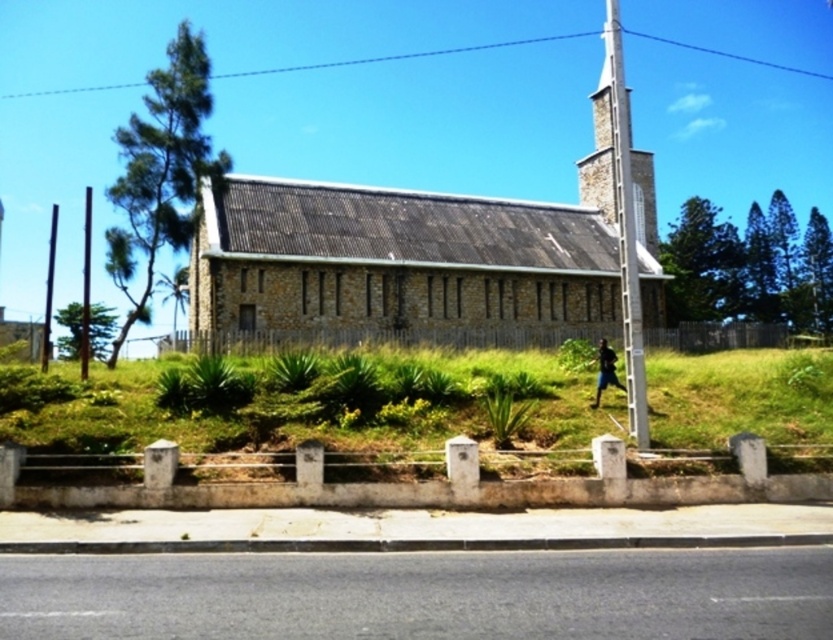
You are standing in front of the church and want to place a small bench between the two points labeled point (661, 276) and point (636, 202). Which point should the bench be closer to in order to be nearer to the viewer?

The bench should be placed closer to point (661, 276) because it is closer to the viewer than point (636, 202).

You are a gardener who needs to install a new 12 feet long flower bed between the gray concrete curb at lower center and the dark blue fabric at right. Based on the scene description, will there be enough space to place the flower bed between them?

The distance between the gray concrete curb at lower center and the dark blue fabric at right is 15.84 feet. Since the flower bed is 12 feet long, there is enough space to place it between them as 15.84 feet is greater than 12 feet.

You are a landscape architect designing a new garden layout around the brown stone church at center and stone steeple at upper center. Given the spatial constraints, which structure has a wider base that you need to consider for planting around?

The stone steeple at upper center has a wider base than the brown stone church at center, so you should consider its width when planning the garden layout.